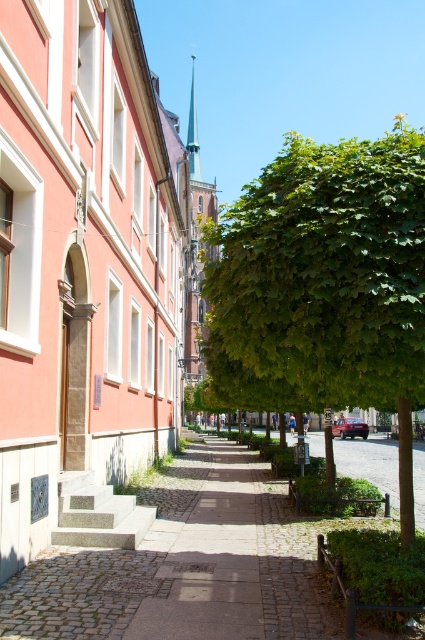
Question: Is green leafy tree at center closer to camera compared to cobblestone sidewalk at center?

Choices:
 (A) yes
 (B) no

Answer: (A)

Question: Which point is farther to the camera?

Choices:
 (A) (232, 561)
 (B) (340, 220)

Answer: (A)

Question: Which of the following is the closest to the observer?

Choices:
 (A) cobblestone sidewalk at center
 (B) green leafy tree at center

Answer: (B)

Question: Is green leafy tree at center smaller than cobblestone sidewalk at center?

Choices:
 (A) yes
 (B) no

Answer: (B)

Question: Can you confirm if green leafy tree at center is positioned to the left of cobblestone sidewalk at center?

Choices:
 (A) no
 (B) yes

Answer: (A)

Question: Which point is closer to the camera?

Choices:
 (A) (223, 630)
 (B) (399, 401)

Answer: (A)